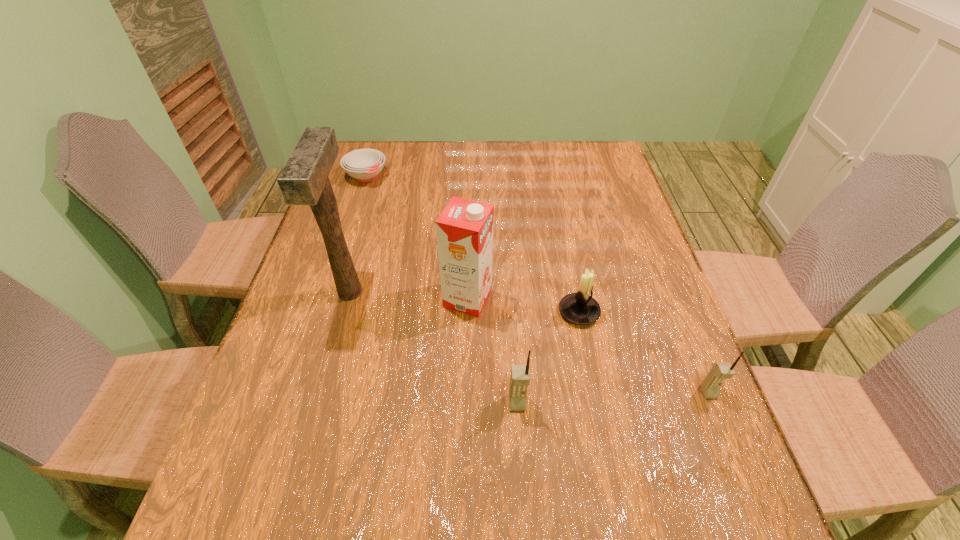
Considering the uniform spacing of cellular telephones, where should an additional cellular telephone be positioned on the left? Please locate a free spot. Please provide its 2D coordinates. Your answer should be formatted as a tuple, i.e. [(x, y)], where the tuple contains the x and y coordinates of a point satisfying the conditions above.

[(319, 413)]